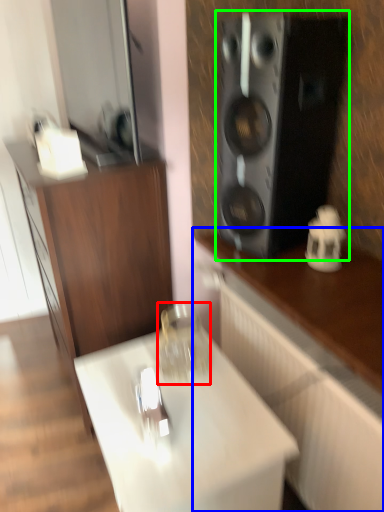
Question: Estimate the real-world distances between objects in this image. Which object is farther from glass jar (highlighted by a red box), cabinetry (highlighted by a blue box) or speaker (highlighted by a green box)?

Choices:
 (A) cabinetry
 (B) speaker

Answer: (B)